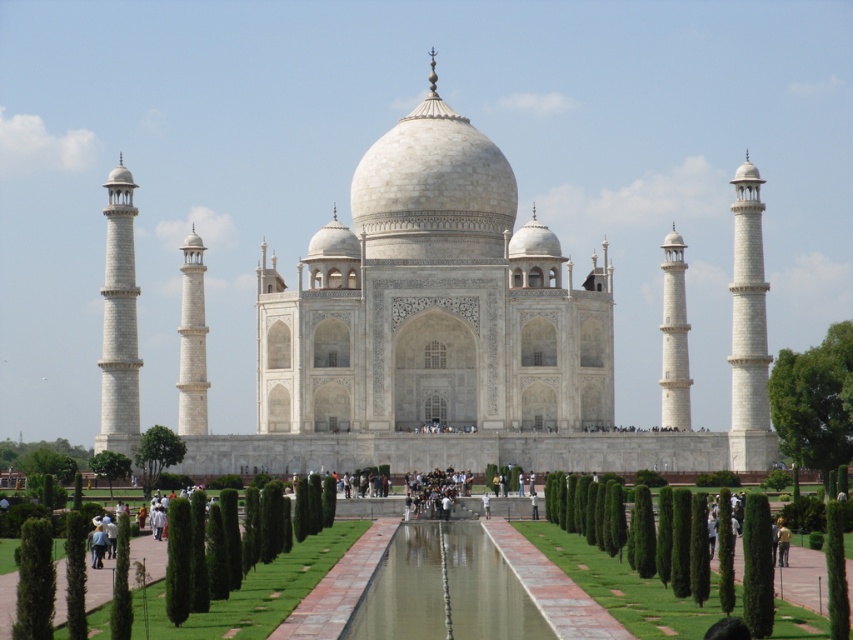
Does white marble taj mahal at center have a greater height compared to green grass at center?

Yes, white marble taj mahal at center is taller than green grass at center.

Is white marble taj mahal at center below green grass at center?

Incorrect, white marble taj mahal at center is not positioned below green grass at center.

Where is `white marble taj mahal at center`? white marble taj mahal at center is located at coordinates (463, 332).

Based on the photo, between green grass at center and dark blue jeans at center, which one appears on the left side from the viewer's perspective?

Positioned to the left is dark blue jeans at center.

Can you confirm if green grass at center is positioned above dark blue jeans at center?

Actually, green grass at center is below dark blue jeans at center.

What do you see at coordinates (550, 588) in the screenshot? I see `green grass at center` at bounding box center [550, 588].

You are a GUI agent. You are given a task and a screenshot of the screen. Output one action in this format:
    pyautogui.click(x=<x>, y=<y>)
    Task: Click on the green grass at center
    The image size is (853, 640).
    Given the screenshot: What is the action you would take?
    pyautogui.click(x=550, y=588)

Does point (393, 156) come closer to viewer compared to point (463, 474)?

No, it is not.

Is the position of white marble taj mahal at center more distant than that of dark blue jeans at center?

Yes, white marble taj mahal at center is further from the viewer.

Find the location of a particular element. white marble taj mahal at center is located at coordinates (463, 332).